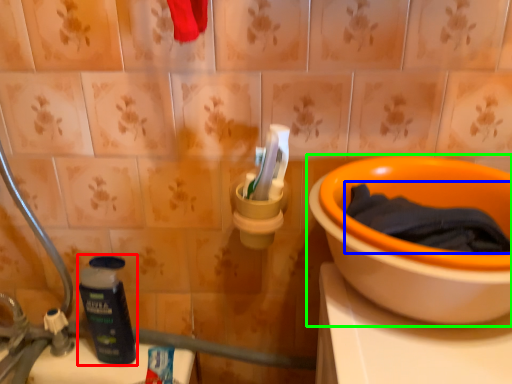
Question: Which is nearer to the bottle (highlighted by a red box)? bath towel (highlighted by a blue box) or toilet (highlighted by a green box).

Choices:
 (A) bath towel
 (B) toilet

Answer: (B)